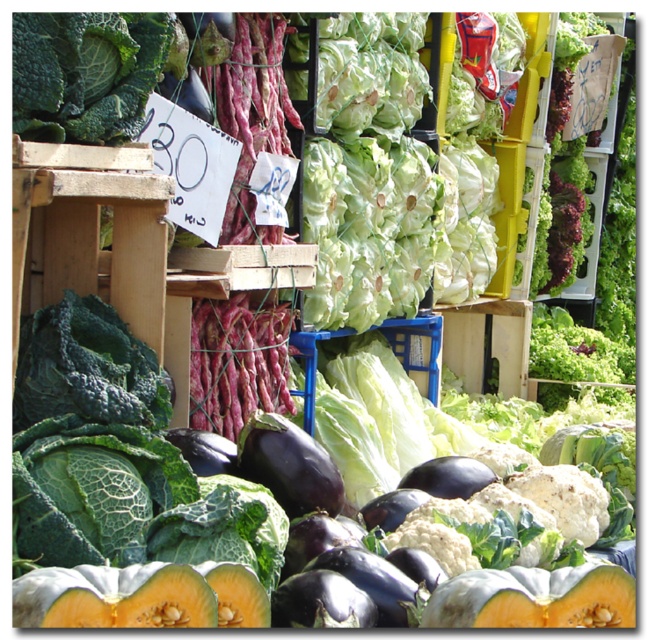
Question: Which point is closer to the camera?

Choices:
 (A) (283, 497)
 (B) (465, 573)
 (C) (86, 611)

Answer: (C)

Question: Is smooth orange melon at lower center further to the viewer compared to shiny purple eggplant at center?

Choices:
 (A) yes
 (B) no

Answer: (B)

Question: Can you confirm if orange-fleshed melon at lower left is positioned below smooth orange melon at lower center?

Choices:
 (A) no
 (B) yes

Answer: (A)

Question: Considering the relative positions of smooth orange melon at lower center and shiny purple eggplant at center in the image provided, where is smooth orange melon at lower center located with respect to shiny purple eggplant at center?

Choices:
 (A) left
 (B) right

Answer: (B)

Question: Which of the following is the farthest from the observer?

Choices:
 (A) shiny purple eggplant at center
 (B) smooth orange melon at lower center
 (C) orange-fleshed melon at lower left

Answer: (A)

Question: Estimate the real-world distances between objects in this image. Which object is farther from the orange-fleshed melon at lower left?

Choices:
 (A) shiny purple eggplant at center
 (B) smooth orange melon at lower center

Answer: (A)